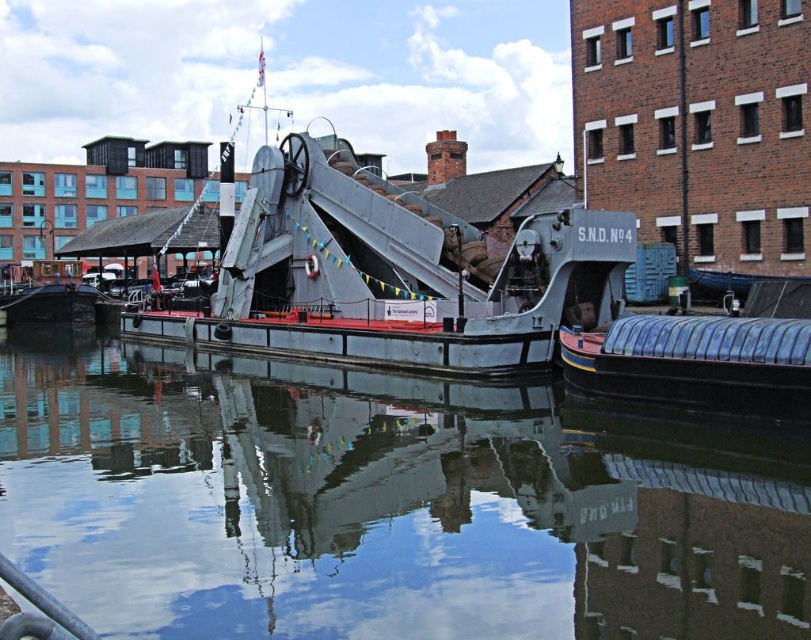
Question: Which point is closer to the camera?

Choices:
 (A) (719, 403)
 (B) (132, 314)

Answer: (A)

Question: Which point appears closest to the camera in this image?

Choices:
 (A) (760, 344)
 (B) (604, 262)
 (C) (136, 483)

Answer: (C)

Question: Is transparent water at center smaller than blue rubber boat at lower right?

Choices:
 (A) yes
 (B) no

Answer: (B)

Question: Is transparent water at center closer to the viewer compared to blue rubber boat at lower right?

Choices:
 (A) no
 (B) yes

Answer: (B)

Question: Among these points, which one is farthest from the camera?

Choices:
 (A) (518, 230)
 (B) (648, 380)
 (C) (591, 536)

Answer: (A)

Question: Can you confirm if transparent water at center is positioned to the left of blue rubber boat at lower right?

Choices:
 (A) yes
 (B) no

Answer: (A)